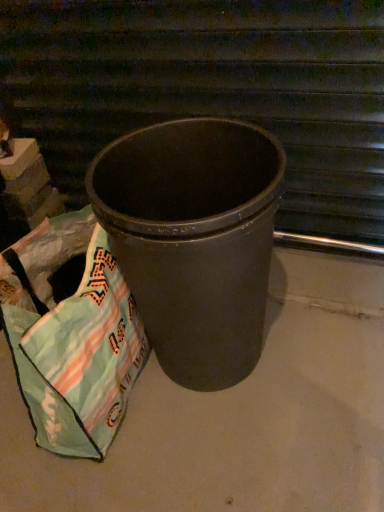
At what (x,y) coordinates should I click in order to perform the action: click on vacant point to the right of matte black trash can at center. Please return your answer as a coordinate pair (x, y). The height and width of the screenshot is (512, 384). Looking at the image, I should click on (330, 352).